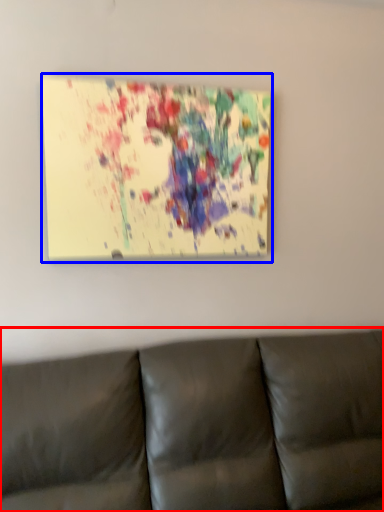
Question: Among these objects, which one is nearest to the camera, studio couch (highlighted by a red box) or picture frame (highlighted by a blue box)?

Choices:
 (A) studio couch
 (B) picture frame

Answer: (A)